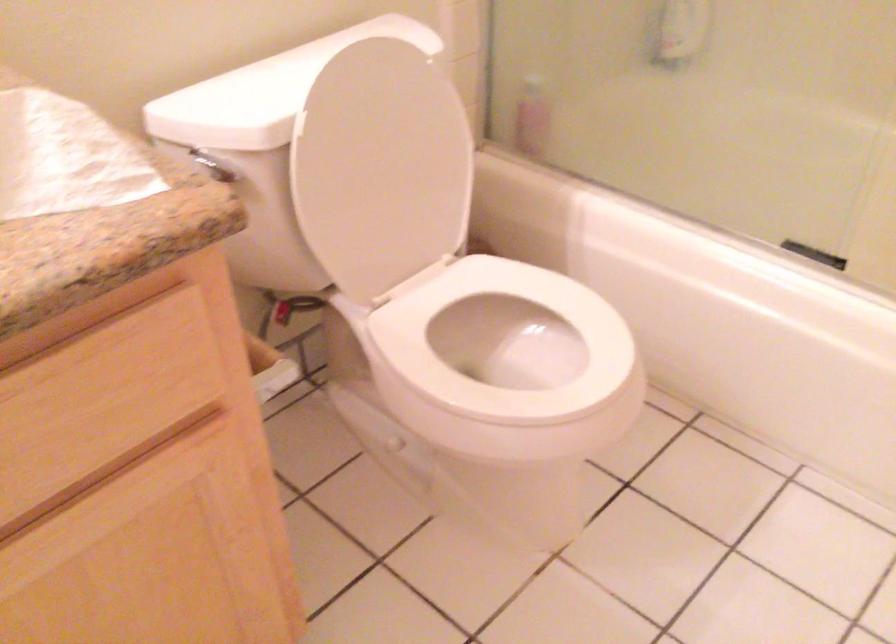
Where would you lower the white toilet seat? Please return your answer as a coordinate pair (x, y).

(504, 348)